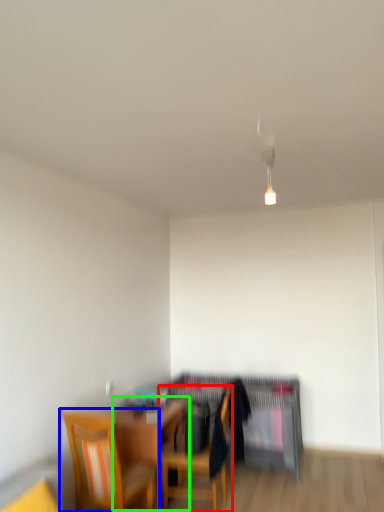
Question: Considering the real-world distances, which object is farthest from chair (highlighted by a red box)? chair (highlighted by a blue box) or table (highlighted by a green box)?

Choices:
 (A) chair
 (B) table

Answer: (A)